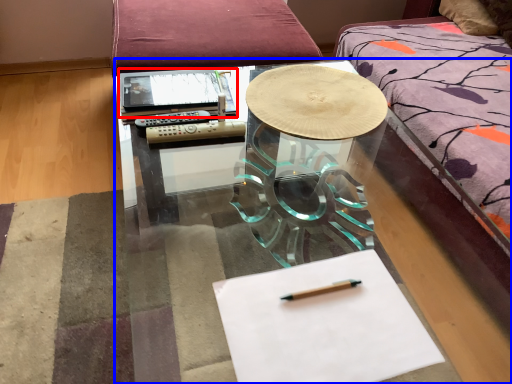
Question: Which point is further to the camera, notebook (highlighted by a red box) or table (highlighted by a blue box)?

Choices:
 (A) notebook
 (B) table

Answer: (A)